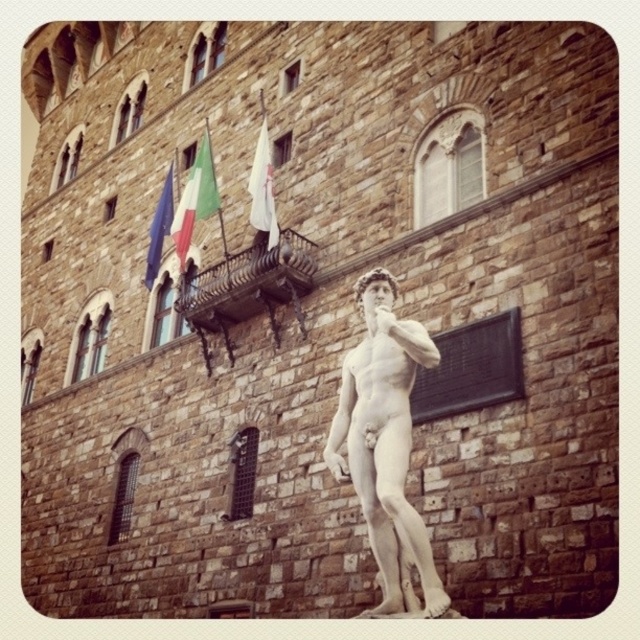
Is green fabric flag at upper center wider than blue fabric flag at upper left?

Correct, the width of green fabric flag at upper center exceeds that of blue fabric flag at upper left.

Which is behind, point (204, 129) or point (161, 195)?

Point (161, 195)

Image resolution: width=640 pixels, height=640 pixels. I want to click on green fabric flag at upper center, so click(x=196, y=200).

Can you confirm if white marble statue at center is positioned below white fabric flag at upper center?

Yes, white marble statue at center is below white fabric flag at upper center.

Locate an element on the screen. white marble statue at center is located at coordinates (385, 444).

Is point (442, 600) positioned in front of point (253, 218)?

Yes, point (442, 600) is in front of point (253, 218).

Locate an element on the screen. This screenshot has height=640, width=640. white marble statue at center is located at coordinates (385, 444).

Is green fabric flag at upper center taller than white fabric flag at upper center?

Correct, green fabric flag at upper center is much taller as white fabric flag at upper center.

Does point (182, 195) lie in front of point (262, 208)?

That is False.

Where is `green fabric flag at upper center`? green fabric flag at upper center is located at coordinates (196, 200).